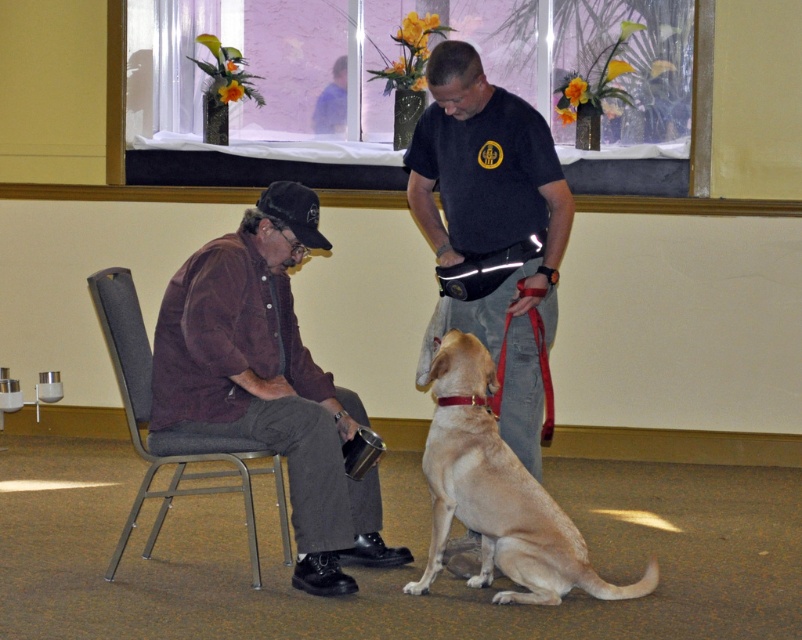
Can you confirm if light brown fur at center is smaller than gray fabric chair at left?

Correct, light brown fur at center occupies less space than gray fabric chair at left.

Describe the element at coordinates (497, 493) in the screenshot. Image resolution: width=802 pixels, height=640 pixels. I see `light brown fur at center` at that location.

You are a GUI agent. You are given a task and a screenshot of the screen. Output one action in this format:
    pyautogui.click(x=<x>, y=<y>)
    Task: Click on the light brown fur at center
    Image resolution: width=802 pixels, height=640 pixels.
    Given the screenshot: What is the action you would take?
    pyautogui.click(x=497, y=493)

You are a GUI agent. You are given a task and a screenshot of the screen. Output one action in this format:
    pyautogui.click(x=<x>, y=<y>)
    Task: Click on the light brown fur at center
    
    Given the screenshot: What is the action you would take?
    pyautogui.click(x=497, y=493)

Does dark gray t-shirt at center have a smaller size compared to gray fabric chair at left?

Yes, dark gray t-shirt at center is smaller than gray fabric chair at left.

Between point (517, 298) and point (177, 483), which one is positioned in front?

Positioned in front is point (517, 298).

Locate an element on the screen. dark gray t-shirt at center is located at coordinates (492, 220).

Who is more forward, (160, 413) or (438, 529)?

Point (438, 529)

Is point (169, 340) behind point (452, 476)?

Yes, it is.

Identify the location of brown suede shirt at left. (269, 381).